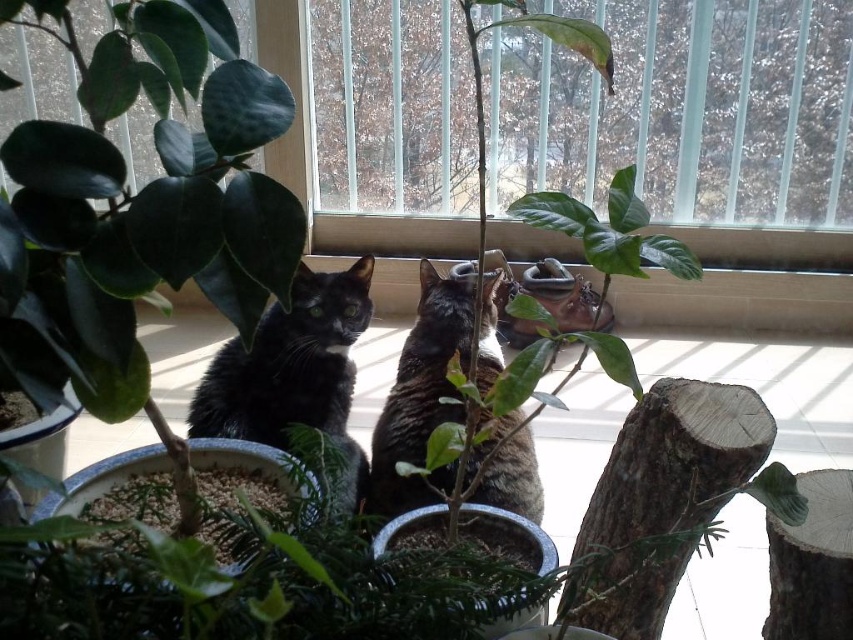
Consider the image. You are a photographer wanting to capture both the transparent plastic window at center and the black fur cat at center in a single frame. Given that the window is larger, which object should you focus on first to ensure both are in the frame?

The transparent plastic window at center is bigger than the black fur cat at center, so you should focus on the transparent plastic window at center first to ensure both fit in the frame.

In the scene shown: You are a photographer trying to capture the black glossy cat at center through the transparent plastic window at center. Given that the window is larger than the cat, will the cat fit entirely within the window frame in the photo?

The transparent plastic window at center has a larger size compared to the black glossy cat at center, so the cat will fit entirely within the window frame in the photo.